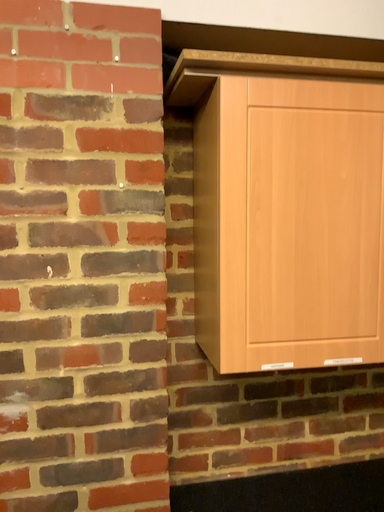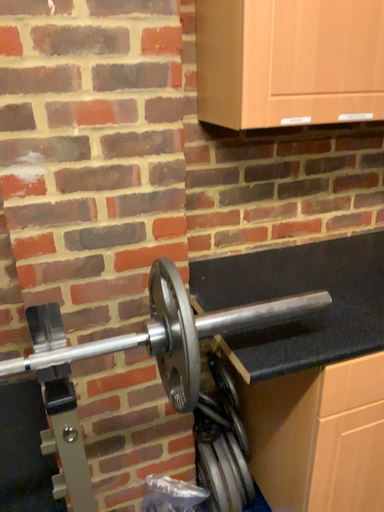
Question: How did the camera likely rotate when shooting the video?

Choices:
 (A) rotated downward
 (B) rotated upward

Answer: (A)